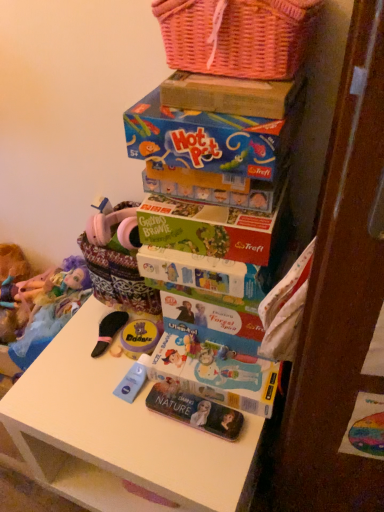
Question: Should I look upward or downward to see white matte table at center?

Choices:
 (A) up
 (B) down

Answer: (B)

Question: Does green matte board game at center have a greater height compared to matte yellow container at center, marked as the 2th toy in a back-to-front arrangement?

Choices:
 (A) yes
 (B) no

Answer: (A)

Question: Is green matte board game at center in front of matte yellow container at center, the 2th toy from the left?

Choices:
 (A) no
 (B) yes

Answer: (B)

Question: Can you confirm if green matte board game at center is wider than matte yellow container at center, acting as the 1th toy starting from the front?

Choices:
 (A) yes
 (B) no

Answer: (A)

Question: Can you confirm if green matte board game at center is smaller than matte yellow container at center, acting as the 1th toy starting from the front?

Choices:
 (A) no
 (B) yes

Answer: (A)

Question: From a real-world perspective, is green matte board game at center below matte yellow container at center, the 2th toy from the left?

Choices:
 (A) yes
 (B) no

Answer: (B)

Question: From the image's perspective, is green matte board game at center over matte yellow container at center, the 2th toy from the left?

Choices:
 (A) no
 (B) yes

Answer: (B)

Question: Can you confirm if white matte table at center is bigger than plush doll at left, acting as the 2th toy starting from the right?

Choices:
 (A) no
 (B) yes

Answer: (B)

Question: From a real-world perspective, is white matte table at center located higher than plush doll at left, the second toy when ordered from front to back?

Choices:
 (A) no
 (B) yes

Answer: (A)

Question: Is white matte table at center positioned with its back to plush doll at left, which is the first toy in back-to-front order?

Choices:
 (A) no
 (B) yes

Answer: (A)

Question: From a real-world perspective, does white matte table at center sit lower than plush doll at left, which is the first toy in back-to-front order?

Choices:
 (A) no
 (B) yes

Answer: (B)

Question: From the image's perspective, is white matte table at center under plush doll at left, marked as the 1th toy in a left-to-right arrangement?

Choices:
 (A) no
 (B) yes

Answer: (B)

Question: Can you see white matte table at center touching plush doll at left, acting as the 2th toy starting from the right?

Choices:
 (A) no
 (B) yes

Answer: (A)

Question: From the image's perspective, is green matte board game at center located beneath pink wicker basket at upper center?

Choices:
 (A) yes
 (B) no

Answer: (A)